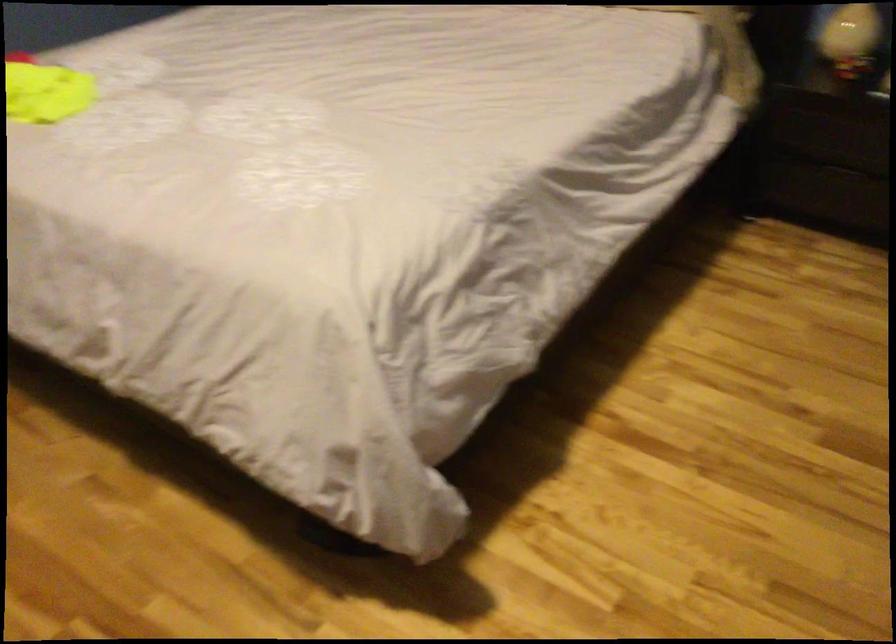
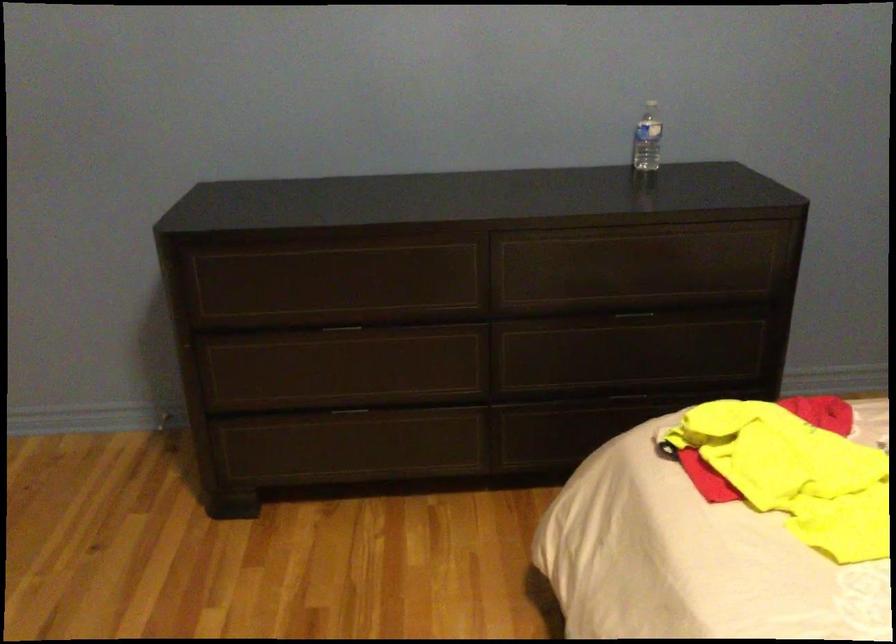
Question: Based on the continuous images, in which direction is the camera rotating? Reply with the corresponding letter.

Choices:
 (A) Left
 (B) Right
 (C) Up
 (D) Down

Answer: (A)